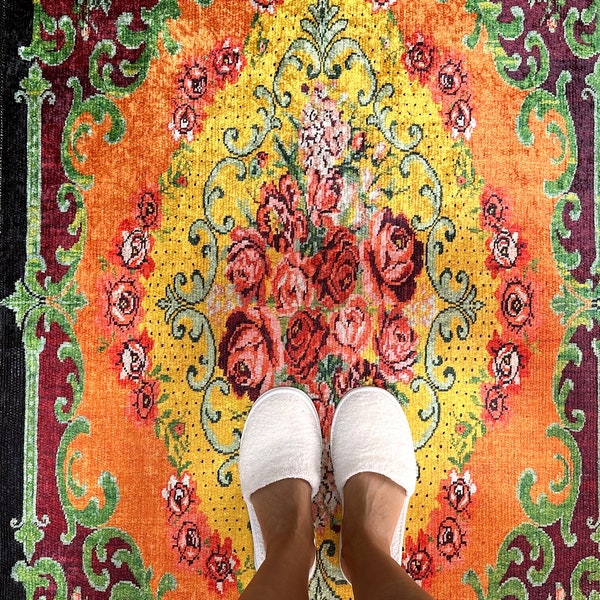
You are a GUI agent. You are given a task and a screenshot of the screen. Output one action in this format:
    pyautogui.click(x=<x>, y=<y>)
    Task: Click on the right slipper
    This screenshot has height=600, width=600.
    Given the screenshot: What is the action you would take?
    [x=382, y=440]